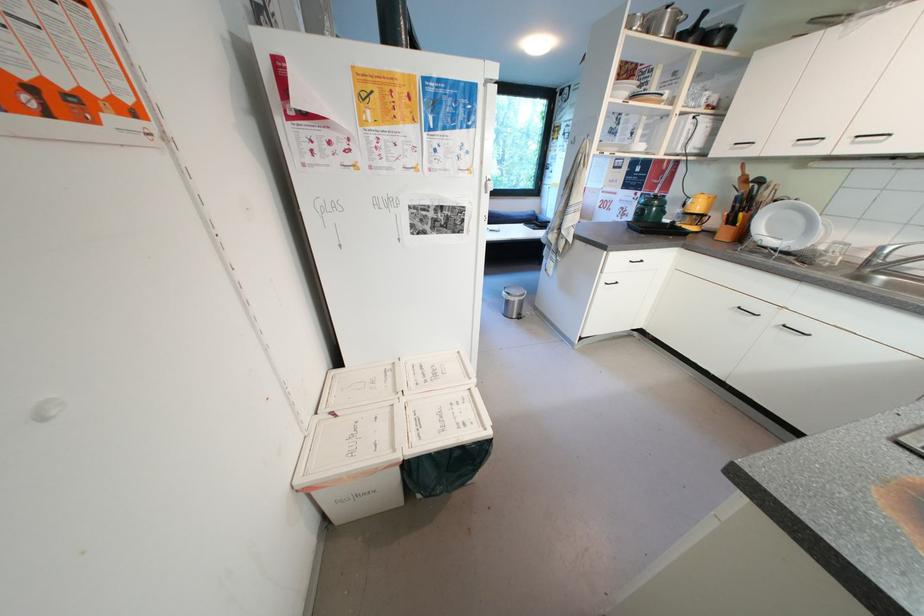
What do you see at coordinates (743, 179) in the screenshot? Image resolution: width=924 pixels, height=616 pixels. I see `a yellow kettle handle` at bounding box center [743, 179].